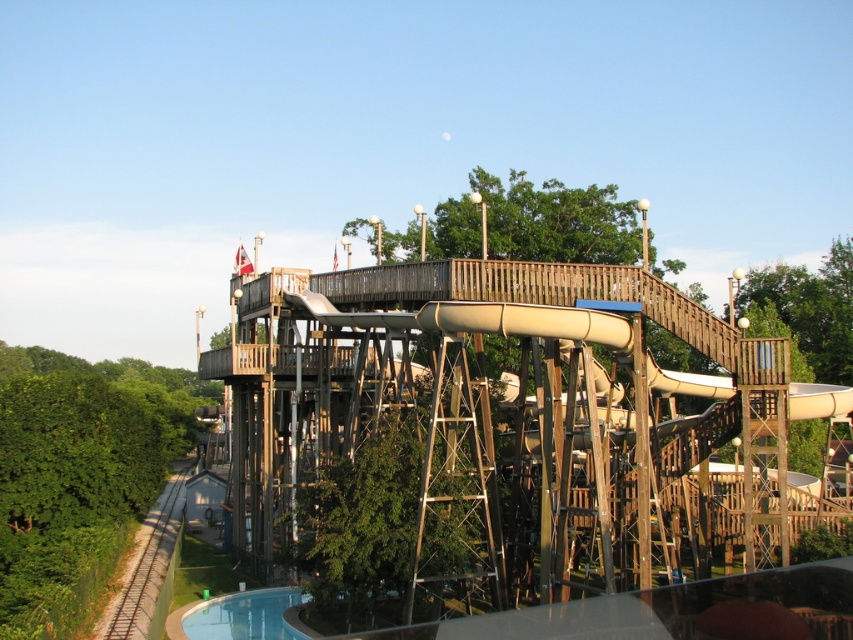
Is wooden water slide at upper center taller than blue glossy pool at lower center?

Correct, wooden water slide at upper center is much taller as blue glossy pool at lower center.

Between point (471, 401) and point (672, 600), which one is positioned behind?

The point (471, 401) is more distant.

Between point (421, 353) and point (228, 595), which one is positioned behind?

The point (421, 353) is more distant.

At what (x,y) coordinates should I click in order to perform the action: click on wooden water slide at upper center. Please return your answer as a coordinate pair (x, y). The image size is (853, 640). Looking at the image, I should click on (372, 442).